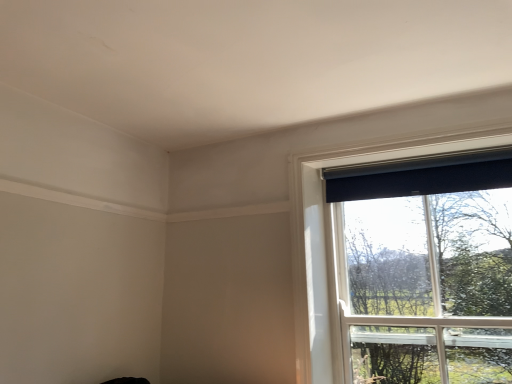
Question: Considering the relative sizes of black matte curtain at upper right and black matte window at upper right in the image provided, is black matte curtain at upper right shorter than black matte window at upper right?

Choices:
 (A) yes
 (B) no

Answer: (A)

Question: Is black matte curtain at upper right to the right of black matte window at upper right from the viewer's perspective?

Choices:
 (A) yes
 (B) no

Answer: (B)

Question: Are black matte curtain at upper right and black matte window at upper right far apart?

Choices:
 (A) no
 (B) yes

Answer: (A)

Question: Can we say black matte curtain at upper right lies outside black matte window at upper right?

Choices:
 (A) no
 (B) yes

Answer: (A)

Question: From the image's perspective, is black matte curtain at upper right located beneath black matte window at upper right?

Choices:
 (A) no
 (B) yes

Answer: (A)

Question: From a real-world perspective, is black matte curtain at upper right under black matte window at upper right?

Choices:
 (A) yes
 (B) no

Answer: (B)

Question: Is black matte window at upper right at the left side of black matte curtain at upper right?

Choices:
 (A) no
 (B) yes

Answer: (A)

Question: From the image's perspective, is black matte window at upper right under black matte curtain at upper right?

Choices:
 (A) no
 (B) yes

Answer: (B)

Question: Does black matte window at upper right lie behind black matte curtain at upper right?

Choices:
 (A) yes
 (B) no

Answer: (B)

Question: Is black matte window at upper right smaller than black matte curtain at upper right?

Choices:
 (A) yes
 (B) no

Answer: (B)

Question: Is black matte window at upper right oriented away from black matte curtain at upper right?

Choices:
 (A) no
 (B) yes

Answer: (B)

Question: Could you tell me if black matte window at upper right is facing black matte curtain at upper right?

Choices:
 (A) yes
 (B) no

Answer: (A)

Question: In the image, is black matte window at upper right on the left side or the right side of black matte curtain at upper right?

Choices:
 (A) left
 (B) right

Answer: (B)